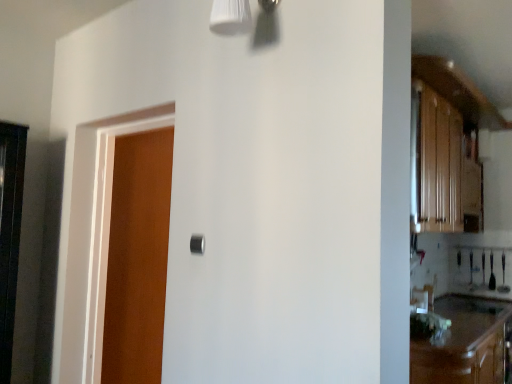
Question: Is the depth of brown wood cabinetry at lower right greater than that of wooden door at left?

Choices:
 (A) no
 (B) yes

Answer: (A)

Question: Can you confirm if brown wood cabinetry at lower right is taller than wooden door at left?

Choices:
 (A) yes
 (B) no

Answer: (B)

Question: From the image's perspective, is brown wood cabinetry at lower right beneath wooden door at left?

Choices:
 (A) yes
 (B) no

Answer: (A)

Question: Does brown wood cabinetry at lower right have a lesser width compared to wooden door at left?

Choices:
 (A) no
 (B) yes

Answer: (A)

Question: Can you confirm if brown wood cabinetry at lower right is bigger than wooden door at left?

Choices:
 (A) no
 (B) yes

Answer: (B)

Question: From the image's perspective, is brown wood cabinetry at lower right above wooden door at left?

Choices:
 (A) no
 (B) yes

Answer: (A)

Question: Is the surface of wooden door at left in direct contact with brown wood cabinetry at lower right?

Choices:
 (A) yes
 (B) no

Answer: (B)

Question: Is wooden door at left at the left side of brown wood cabinetry at lower right?

Choices:
 (A) yes
 (B) no

Answer: (A)

Question: Considering the relative positions of wooden door at left and brown wood cabinetry at lower right in the image provided, is wooden door at left to the right of brown wood cabinetry at lower right from the viewer's perspective?

Choices:
 (A) yes
 (B) no

Answer: (B)

Question: Is wooden door at left bigger than brown wood cabinetry at lower right?

Choices:
 (A) no
 (B) yes

Answer: (A)

Question: From the image's perspective, is wooden door at left under brown wood cabinetry at lower right?

Choices:
 (A) no
 (B) yes

Answer: (A)

Question: Would you say brown wood cabinetry at lower right is part of wooden door at left's contents?

Choices:
 (A) no
 (B) yes

Answer: (A)

Question: Can you confirm if black matte door handle at center is taller than brown wood cabinetry at lower right?

Choices:
 (A) no
 (B) yes

Answer: (A)